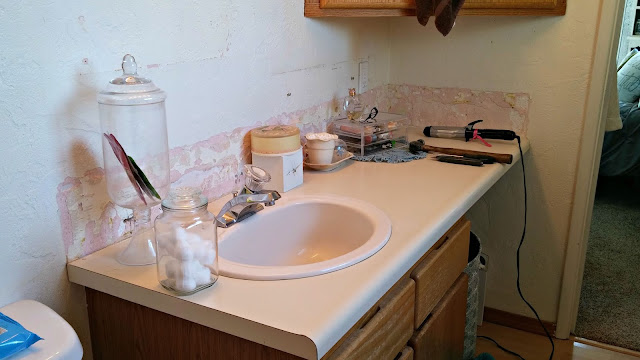
What are the coordinates of `wall` in the screenshot? It's located at (45, 155).